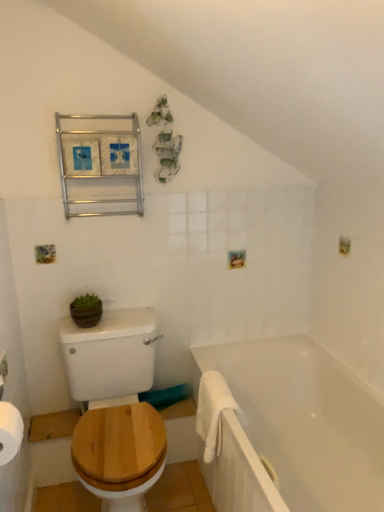
Question: Is white glossy bathtub at lower right inside wooden at left?

Choices:
 (A) yes
 (B) no

Answer: (B)

Question: Is wooden at left thinner than white glossy bathtub at lower right?

Choices:
 (A) no
 (B) yes

Answer: (A)

Question: From the image's perspective, is wooden at left above white glossy bathtub at lower right?

Choices:
 (A) no
 (B) yes

Answer: (B)

Question: Is wooden at left shorter than white glossy bathtub at lower right?

Choices:
 (A) yes
 (B) no

Answer: (B)

Question: Is wooden at left far from white glossy bathtub at lower right?

Choices:
 (A) no
 (B) yes

Answer: (A)

Question: Is wooden at left oriented away from white glossy bathtub at lower right?

Choices:
 (A) no
 (B) yes

Answer: (A)

Question: Considering the relative sizes of metallic frame at upper left and white fluffy bath towel at lower right in the image provided, is metallic frame at upper left smaller than white fluffy bath towel at lower right?

Choices:
 (A) no
 (B) yes

Answer: (A)

Question: Considering the relative sizes of metallic frame at upper left and white fluffy bath towel at lower right in the image provided, is metallic frame at upper left taller than white fluffy bath towel at lower right?

Choices:
 (A) yes
 (B) no

Answer: (A)

Question: Does metallic frame at upper left have a larger size compared to white fluffy bath towel at lower right?

Choices:
 (A) yes
 (B) no

Answer: (A)

Question: Considering the relative positions of metallic frame at upper left and white fluffy bath towel at lower right in the image provided, is metallic frame at upper left to the right of white fluffy bath towel at lower right from the viewer's perspective?

Choices:
 (A) yes
 (B) no

Answer: (B)

Question: Is metallic frame at upper left at the left side of white fluffy bath towel at lower right?

Choices:
 (A) no
 (B) yes

Answer: (B)

Question: Is metallic frame at upper left outside of white fluffy bath towel at lower right?

Choices:
 (A) yes
 (B) no

Answer: (A)

Question: From a real-world perspective, is wooden at left over white fluffy bath towel at lower right?

Choices:
 (A) yes
 (B) no

Answer: (B)